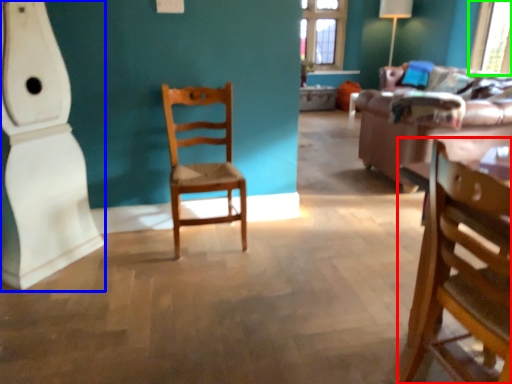
Question: Which object is the farthest from chair (highlighted by a red box)? Choose among these: wide (highlighted by a blue box) or window screen (highlighted by a green box).

Choices:
 (A) wide
 (B) window screen

Answer: (B)